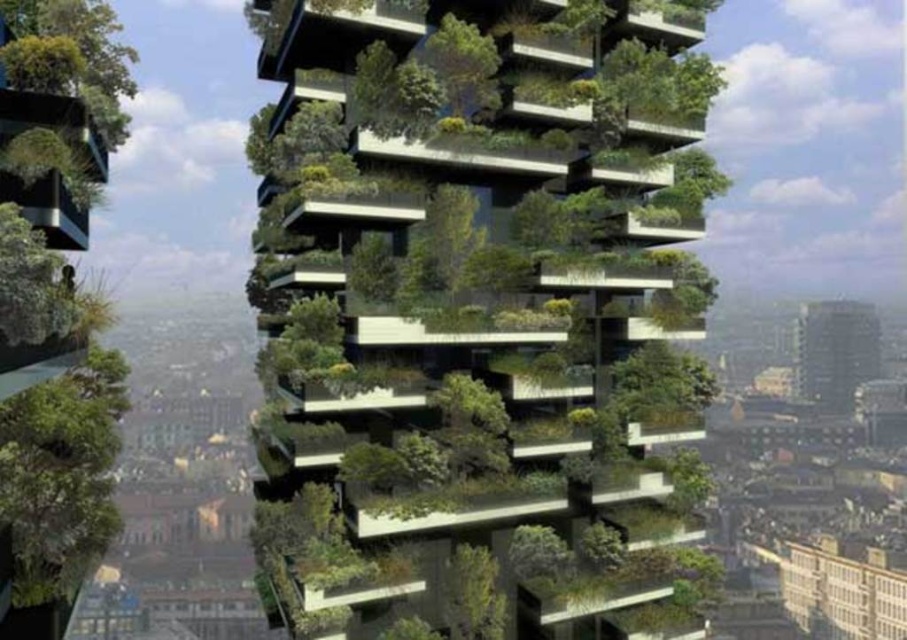
Which is more to the right, green matte/soft building at center or green leafy tree at left?

Positioned to the right is green matte/soft building at center.

Can you confirm if green matte/soft building at center is shorter than green leafy tree at left?

No, green matte/soft building at center is not shorter than green leafy tree at left.

Who is more forward, (639,602) or (7,276)?

Point (7,276) is more forward.

This screenshot has height=640, width=907. In order to click on green matte/soft building at center in this screenshot , I will do `click(473, 273)`.

Is green matte tree at lower left below green leafy tree at left?

Yes, green matte tree at lower left is below green leafy tree at left.

Who is positioned more to the right, green matte tree at lower left or green leafy tree at left?

Positioned to the right is green leafy tree at left.

Describe the element at coordinates (60, 476) in the screenshot. I see `green matte tree at lower left` at that location.

You are a GUI agent. You are given a task and a screenshot of the screen. Output one action in this format:
    pyautogui.click(x=<x>, y=<y>)
    Task: Click on the green matte tree at lower left
    Image resolution: width=907 pixels, height=640 pixels.
    Given the screenshot: What is the action you would take?
    pyautogui.click(x=60, y=476)

Who is shorter, green matte/soft building at center or green matte tree at lower left?

green matte tree at lower left

Between green matte/soft building at center and green matte tree at lower left, which one has more height?

Standing taller between the two is green matte/soft building at center.

Does point (422, 236) come in front of point (10, 472)?

That is True.

Image resolution: width=907 pixels, height=640 pixels. I want to click on green matte/soft building at center, so click(473, 273).